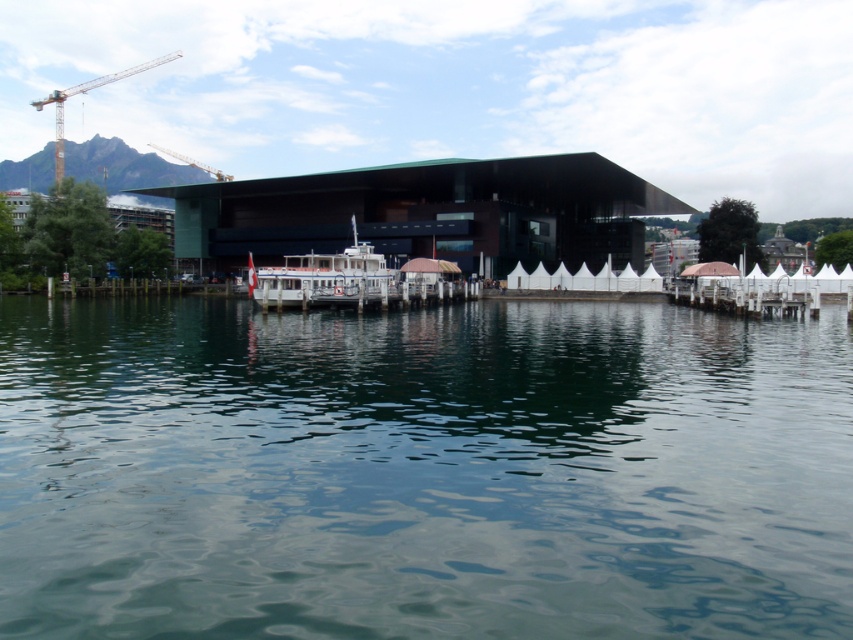
Consider the image. Is green liquid water at center to the right of yellow metal crane at upper left from the viewer's perspective?

Correct, you'll find green liquid water at center to the right of yellow metal crane at upper left.

Is green liquid water at center smaller than yellow metal crane at upper left?

Yes.

Is point (402, 572) farther from camera compared to point (138, 67)?

That is False.

Where is `green liquid water at center`? The width and height of the screenshot is (853, 640). green liquid water at center is located at coordinates (422, 472).

Consider the image. Can you confirm if yellow metal crane at upper left is wider than metallic construction crane at upper left?

Indeed, yellow metal crane at upper left has a greater width compared to metallic construction crane at upper left.

Does yellow metal crane at upper left have a smaller size compared to metallic construction crane at upper left?

Incorrect, yellow metal crane at upper left is not smaller in size than metallic construction crane at upper left.

You are a GUI agent. You are given a task and a screenshot of the screen. Output one action in this format:
    pyautogui.click(x=<x>, y=<y>)
    Task: Click on the yellow metal crane at upper left
    The width and height of the screenshot is (853, 640).
    Given the screenshot: What is the action you would take?
    pyautogui.click(x=84, y=92)

Consider the image. Which of these two, white matte boat at center or metallic construction crane at upper left, stands taller?

metallic construction crane at upper left is taller.

Who is more distant from viewer, [364,269] or [186,160]?

The point [186,160] is more distant.

At what (x,y) coordinates should I click in order to perform the action: click on white matte boat at center. Please return your answer as a coordinate pair (x, y). This screenshot has width=853, height=640. Looking at the image, I should click on (325, 276).